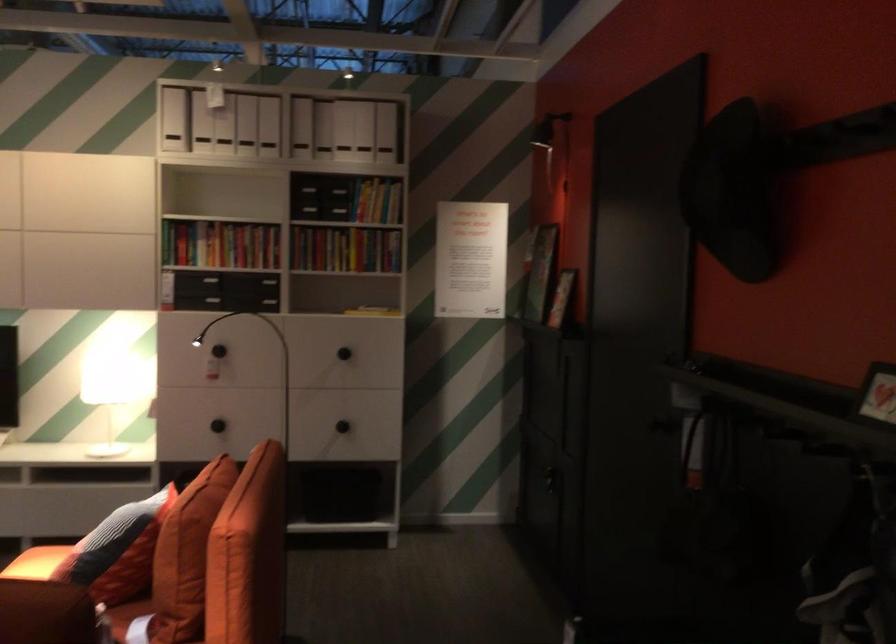
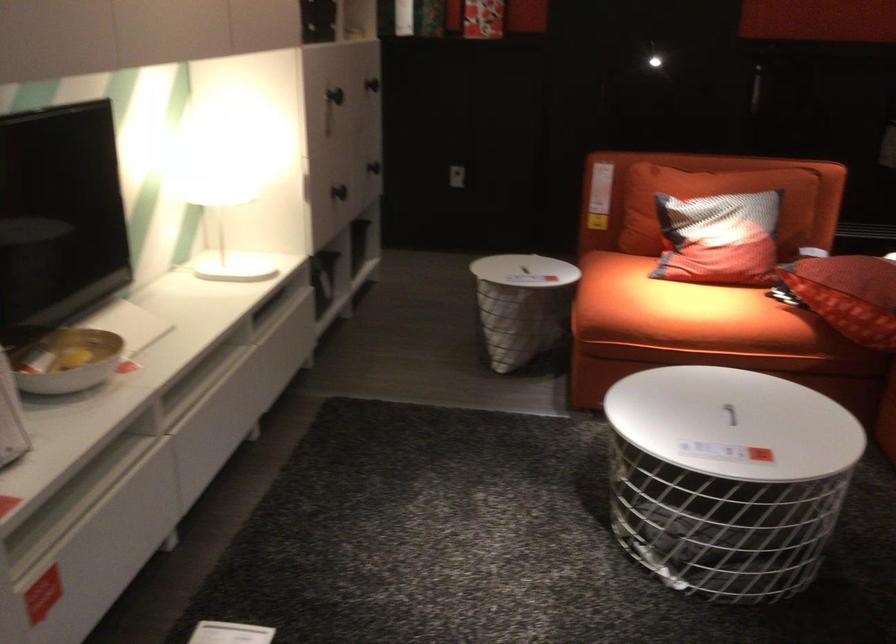
Find the pixel in the second image that matches point (205, 348) in the first image.

(334, 95)